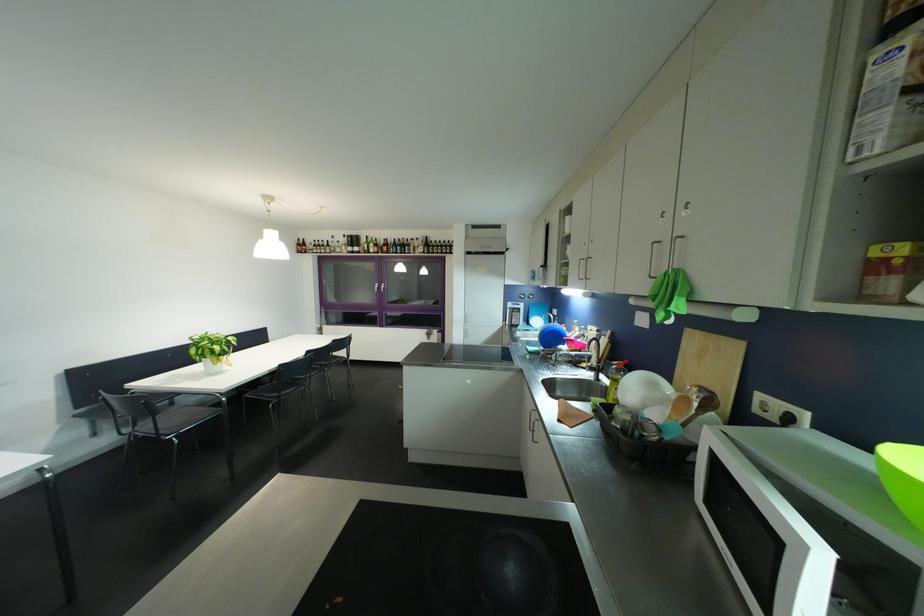
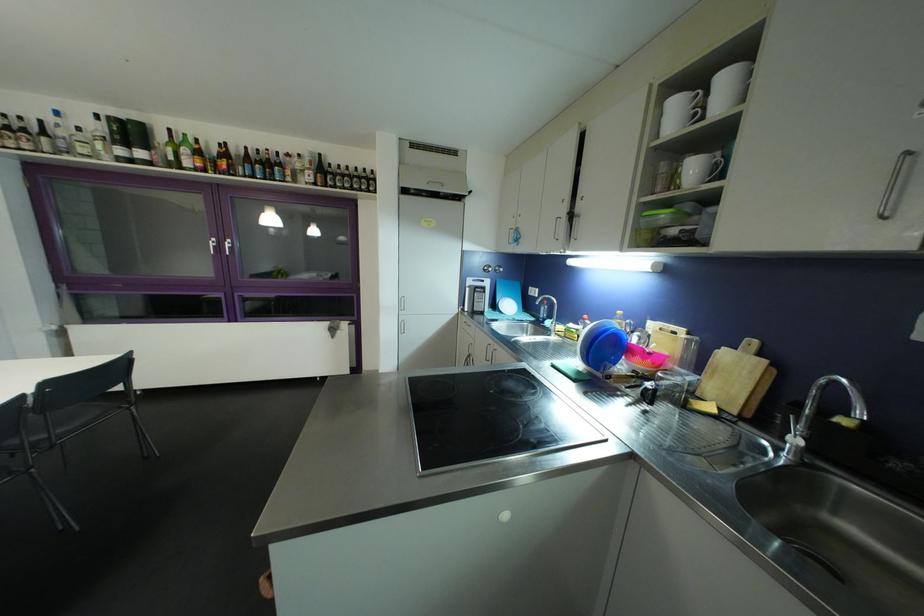
Question: The images are taken continuously from a first-person perspective. In which direction are you moving?

Choices:
 (A) Left
 (B) Right
 (C) Forward
 (D) Backward

Answer: (C)